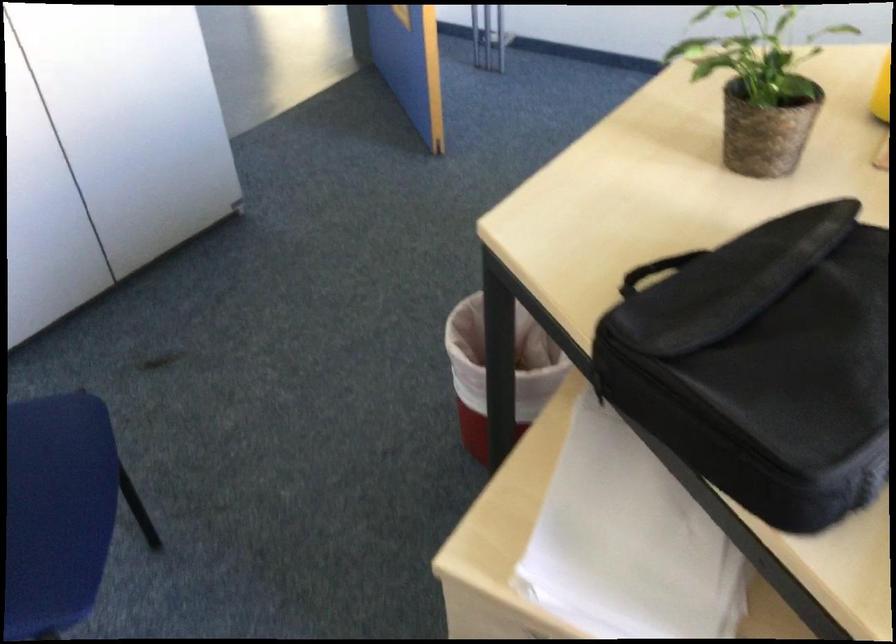
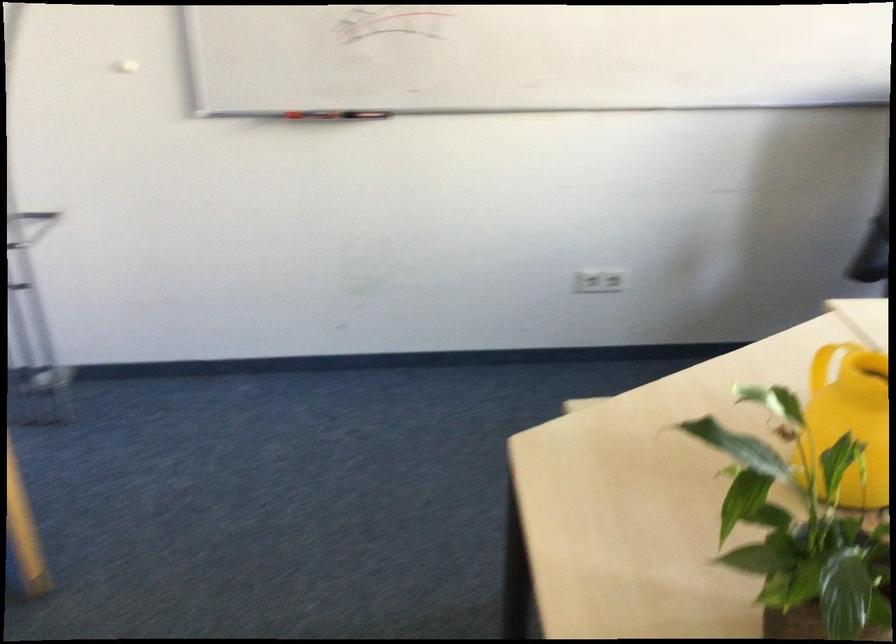
Question: How did the camera likely rotate?

Choices:
 (A) Left
 (B) Right
 (C) Up
 (D) Down

Answer: (B)